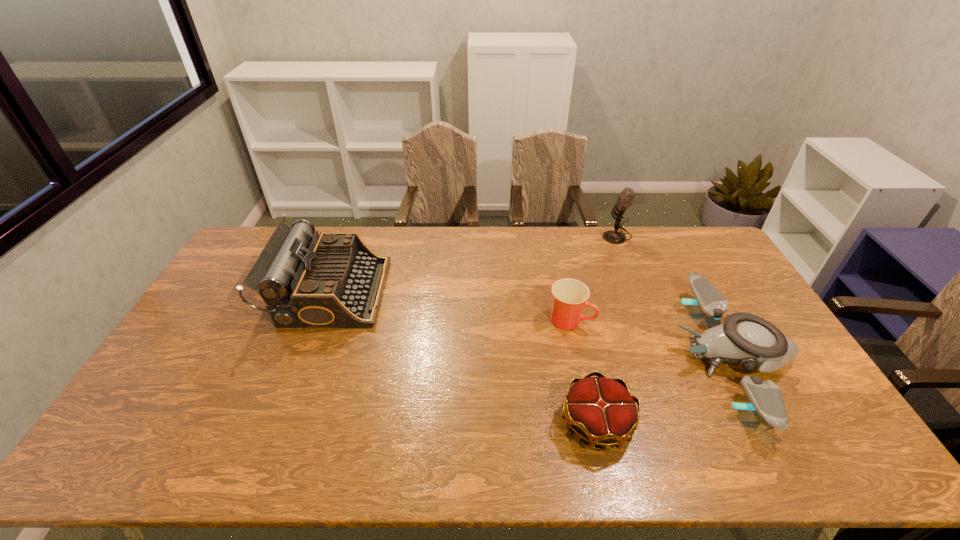
I want to click on vacant area at the far edge of the desktop, so click(481, 232).

The image size is (960, 540). In order to click on vacant space at the left edge of the desktop in this screenshot , I will do `click(156, 386)`.

The image size is (960, 540). What are the coordinates of `free location at the right edge of the desktop` in the screenshot? It's located at (808, 386).

Where is `free region at the far right corner`? The image size is (960, 540). free region at the far right corner is located at coordinates (708, 259).

Where is `free space between the crown and the typewriter`? Image resolution: width=960 pixels, height=540 pixels. free space between the crown and the typewriter is located at coordinates (464, 357).

The width and height of the screenshot is (960, 540). What are the coordinates of `vacant space that's between the farthest object and the drone` in the screenshot? It's located at (675, 296).

Where is `vacant point located between the farthest object and the cup`? vacant point located between the farthest object and the cup is located at coordinates (593, 278).

You are a GUI agent. You are given a task and a screenshot of the screen. Output one action in this format:
    pyautogui.click(x=<x>, y=<y>)
    Task: Click on the empty location between the drone and the leftmost object
    
    Given the screenshot: What is the action you would take?
    pyautogui.click(x=532, y=324)

This screenshot has width=960, height=540. I want to click on free space between the drone and the cup, so click(x=651, y=338).

You are a GUI agent. You are given a task and a screenshot of the screen. Output one action in this format:
    pyautogui.click(x=<x>, y=<y>)
    Task: Click on the blank region between the cup and the crown
    
    Given the screenshot: What is the action you would take?
    pyautogui.click(x=583, y=372)